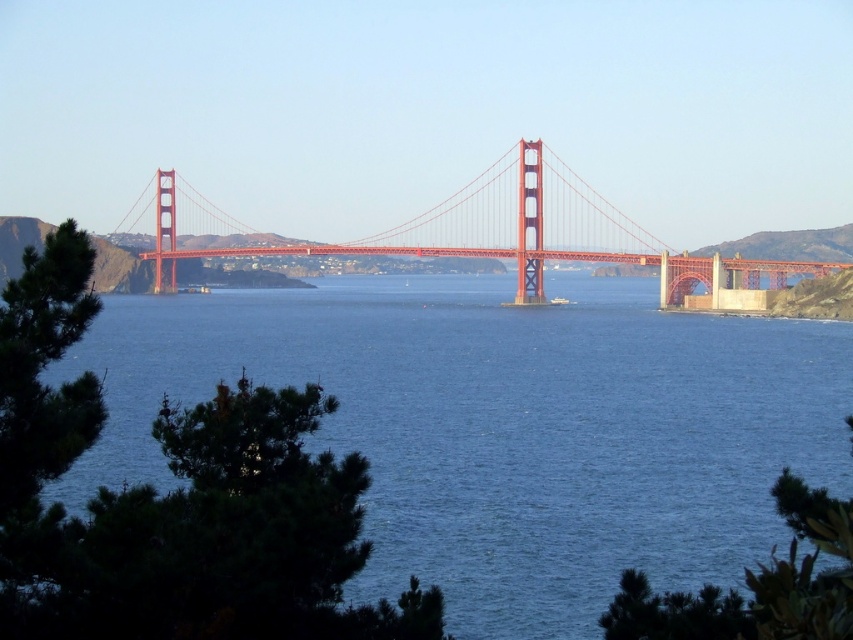
Question: Is blue water at center above green matte tree at center?

Choices:
 (A) no
 (B) yes

Answer: (B)

Question: Can you confirm if green matte tree at center is bigger than green leafy tree at lower right?

Choices:
 (A) yes
 (B) no

Answer: (B)

Question: Which object is the closest to the blue water at center?

Choices:
 (A) glossy steel bridge at center
 (B) green leafy tree at lower right

Answer: (A)

Question: Can you confirm if green matte tree at center is positioned to the right of glossy steel bridge at center?

Choices:
 (A) yes
 (B) no

Answer: (B)

Question: Which of the following is the closest to the observer?

Choices:
 (A) green matte tree at left
 (B) green matte tree at center
 (C) blue water at center
 (D) glossy steel bridge at center

Answer: (B)

Question: Which object is positioned closest to the blue water at center?

Choices:
 (A) green leafy tree at lower right
 (B) green matte tree at left
 (C) green matte tree at center

Answer: (C)